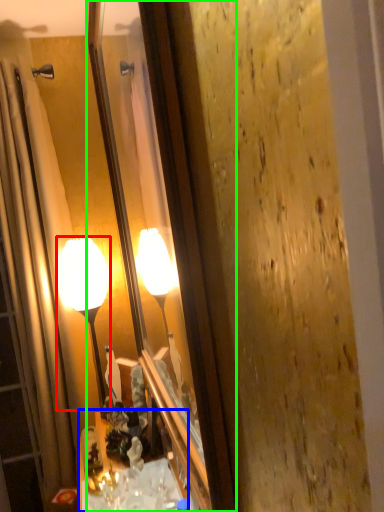
Question: Considering the real-world distances, which object is closest to lamp (highlighted by a red box)? cabinetry (highlighted by a blue box) or mirror (highlighted by a green box).

Choices:
 (A) cabinetry
 (B) mirror

Answer: (A)